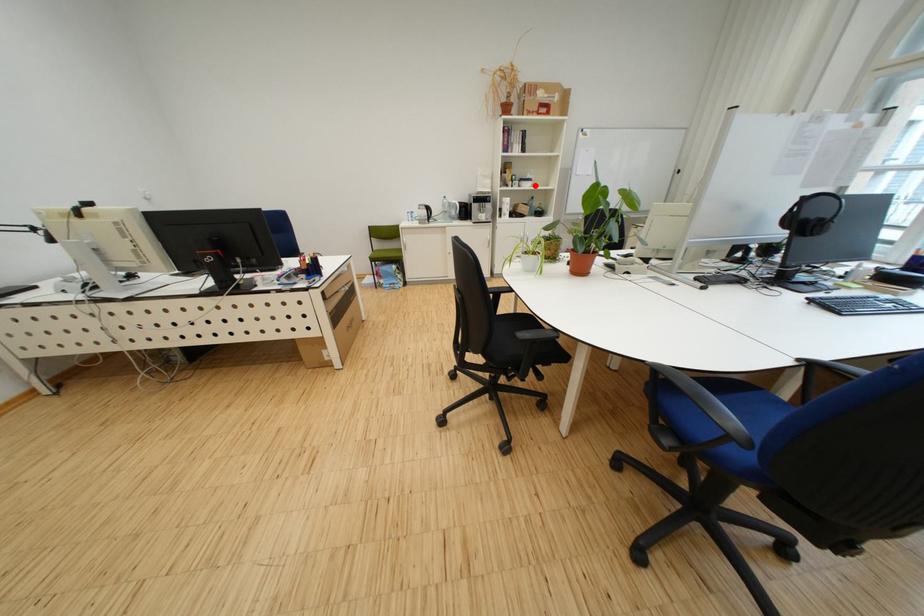
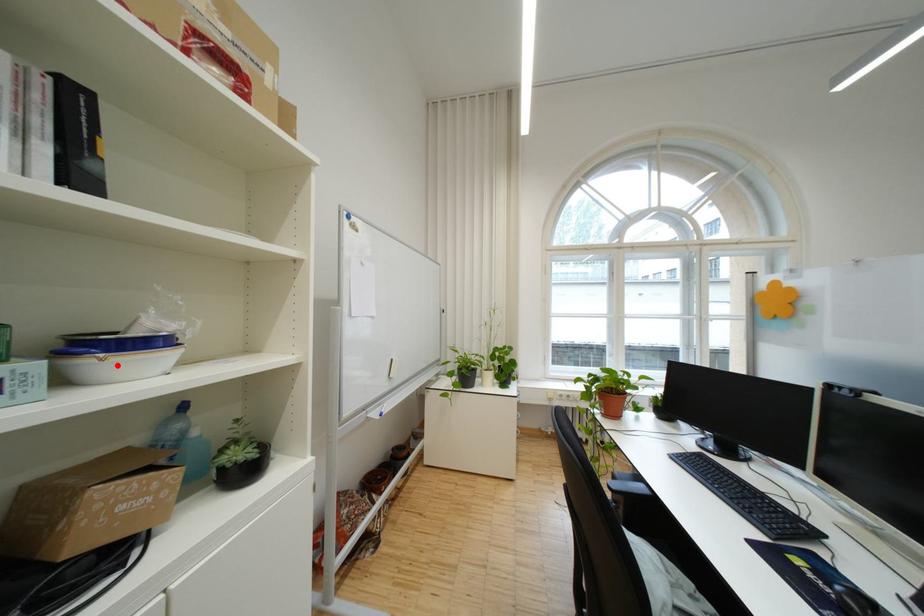
I am providing you with two images of the same scene from different viewpoints. A red point is marked on the first image and another point is marked on the second image. Is the marked point in image1 the same physical position as the marked point in image2?

Yes